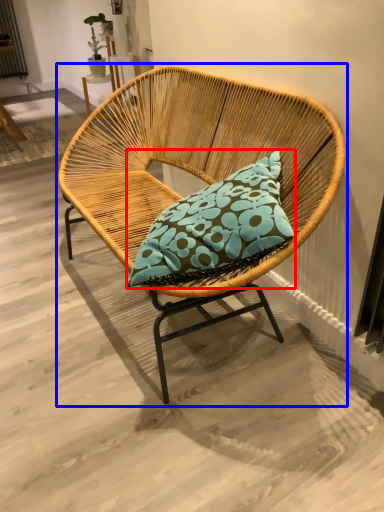
Question: Which object appears closest to the camera in this image, pillow (highlighted by a red box) or chair (highlighted by a blue box)?

Choices:
 (A) pillow
 (B) chair

Answer: (B)